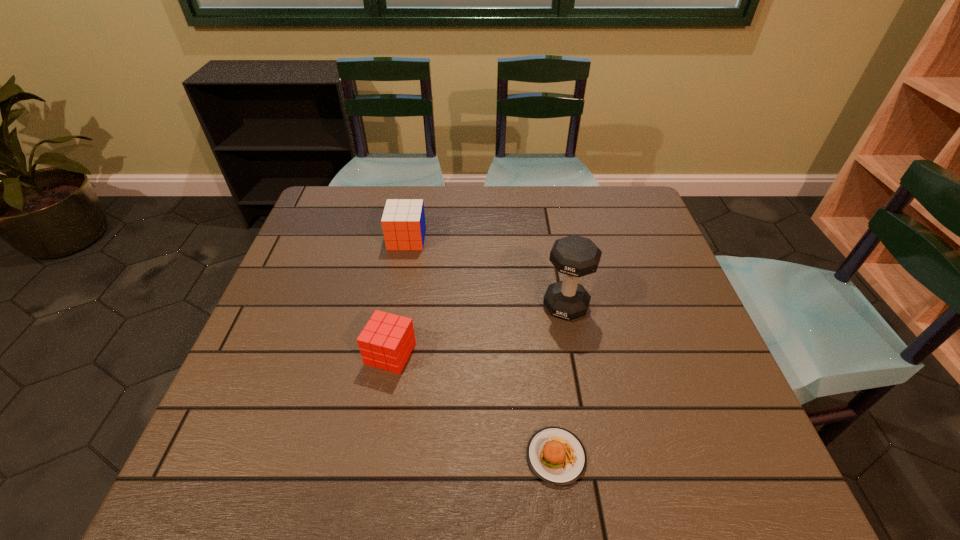
Image resolution: width=960 pixels, height=540 pixels. I want to click on the third nearest object, so click(x=574, y=256).

You are a GUI agent. You are given a task and a screenshot of the screen. Output one action in this format:
    pyautogui.click(x=<x>, y=<y>)
    Task: Click on the tallest object
    This screenshot has width=960, height=540.
    Given the screenshot: What is the action you would take?
    pyautogui.click(x=574, y=256)

Identify the location of the farther cube. (403, 222).

Find the location of a particular element. This screenshot has height=540, width=960. the taller cube is located at coordinates (403, 222).

The image size is (960, 540). I want to click on the third farthest object, so click(386, 342).

Find the location of `the shorter cube`. the shorter cube is located at coordinates (386, 342).

At what (x,y) coordinates should I click in order to perform the action: click on the nearest object. Please return your answer as a coordinate pair (x, y). The image size is (960, 540). Looking at the image, I should click on coord(557,456).

Find the location of `food`. food is located at coordinates (557, 456).

Locate an element on the screen. Image resolution: width=960 pixels, height=540 pixels. free location located 0.070m on the front of the third nearest object is located at coordinates (573, 347).

Locate an element on the screen. Image resolution: width=960 pixels, height=540 pixels. vacant region located 0.060m on the right of the second tallest object is located at coordinates (445, 239).